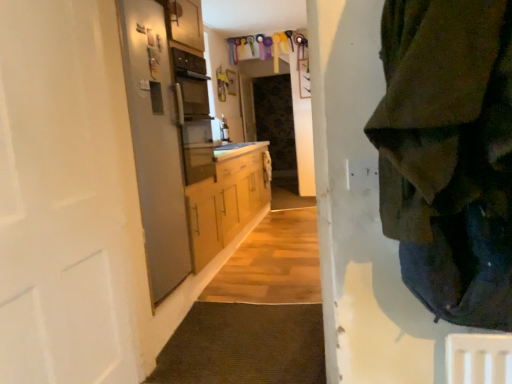
Question: Is white matte door at left bigger than satin silver refrigerator at left?

Choices:
 (A) yes
 (B) no

Answer: (A)

Question: From the image's perspective, is white matte door at left located above satin silver refrigerator at left?

Choices:
 (A) yes
 (B) no

Answer: (B)

Question: Does white matte door at left have a greater height compared to satin silver refrigerator at left?

Choices:
 (A) yes
 (B) no

Answer: (B)

Question: Can you confirm if white matte door at left is positioned to the left of satin silver refrigerator at left?

Choices:
 (A) yes
 (B) no

Answer: (A)

Question: Is satin silver refrigerator at left completely or partially inside white matte door at left?

Choices:
 (A) yes
 (B) no

Answer: (B)

Question: Is white matte door at left in contact with satin silver refrigerator at left?

Choices:
 (A) no
 (B) yes

Answer: (A)

Question: Is satin silver refrigerator at left positioned beyond the bounds of dark green fabric at right?

Choices:
 (A) yes
 (B) no

Answer: (A)

Question: Is dark green fabric at right a part of satin silver refrigerator at left?

Choices:
 (A) yes
 (B) no

Answer: (B)

Question: Considering the relative sizes of satin silver refrigerator at left and dark green fabric at right in the image provided, is satin silver refrigerator at left smaller than dark green fabric at right?

Choices:
 (A) yes
 (B) no

Answer: (A)

Question: From the image's perspective, does satin silver refrigerator at left appear higher than dark green fabric at right?

Choices:
 (A) yes
 (B) no

Answer: (B)

Question: Is satin silver refrigerator at left oriented away from dark green fabric at right?

Choices:
 (A) no
 (B) yes

Answer: (A)

Question: Could you tell me if satin silver refrigerator at left is facing dark green fabric at right?

Choices:
 (A) no
 (B) yes

Answer: (A)

Question: Is the position of white matte door at left less distant than that of dark green fabric at right?

Choices:
 (A) yes
 (B) no

Answer: (B)